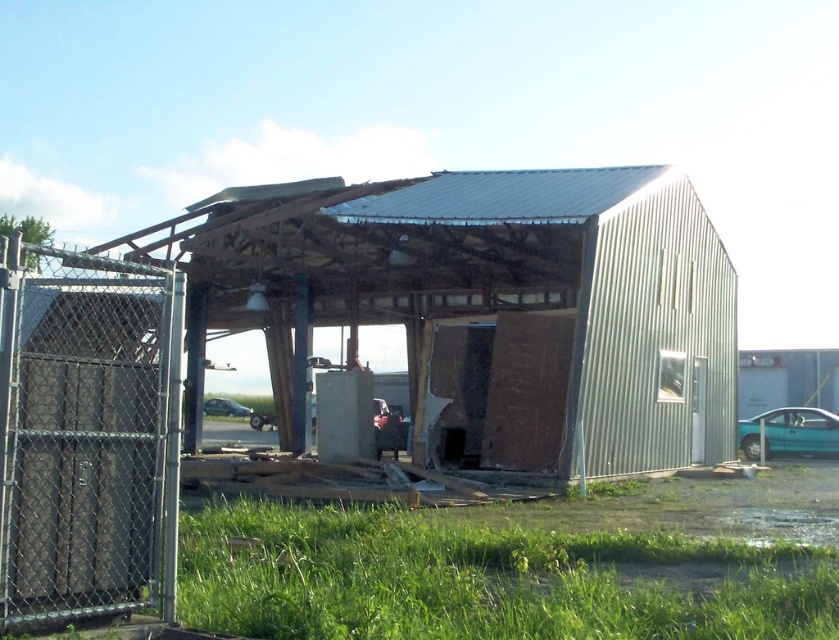
Question: Which object is positioned farthest from the green matte car at center?

Choices:
 (A) teal matte car at lower right
 (B) gray chain-link fence at left

Answer: (B)

Question: Which point appears closest to the camera in this image?

Choices:
 (A) coord(800,449)
 (B) coord(55,461)
 (C) coord(692,388)

Answer: (B)

Question: Is teal matte car at lower right to the right of green matte car at center from the viewer's perspective?

Choices:
 (A) no
 (B) yes

Answer: (B)

Question: Which is farther from the green matte car at center?

Choices:
 (A) metallic corrugated hangar at center
 (B) gray chain-link fence at left
 (C) teal matte car at lower right

Answer: (B)

Question: Does metallic corrugated hangar at center appear under gray chain-link fence at left?

Choices:
 (A) yes
 (B) no

Answer: (A)

Question: Does teal matte car at lower right have a lesser width compared to green matte car at center?

Choices:
 (A) no
 (B) yes

Answer: (B)